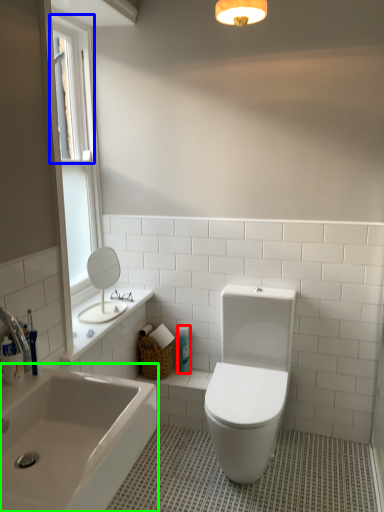
Question: Based on their relative distances, which object is farther from toiletry (highlighted by a red box)? Choose from window screen (highlighted by a blue box) and bathtub (highlighted by a green box).

Choices:
 (A) window screen
 (B) bathtub

Answer: (A)